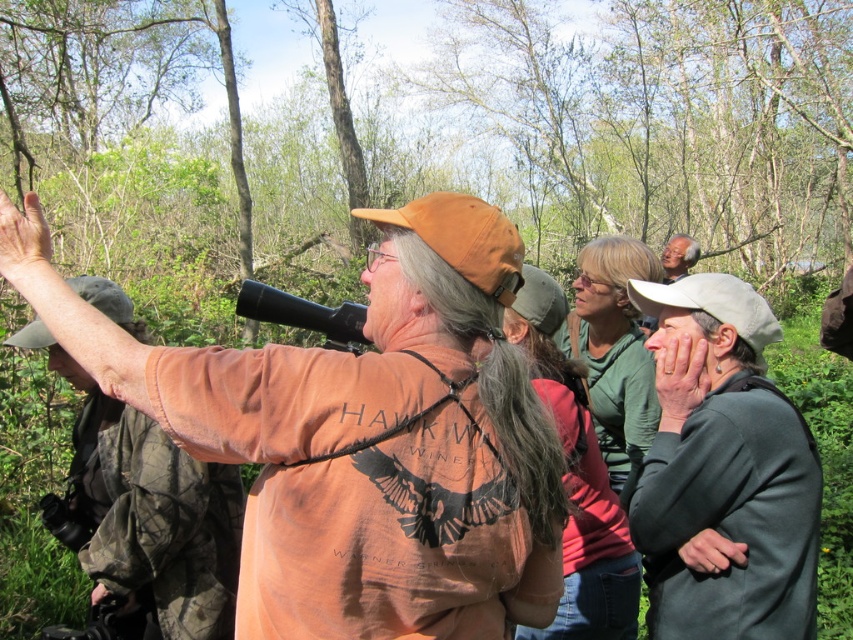
You are a hiker who wants to take a photo of the orange fabric shirt at center and the gray fabric jacket at right. Which one is closer to you?

The orange fabric shirt at center is closer to you because it is in front of the gray fabric jacket at right.

You are a photographer trying to capture a photo of the orange fabric shirt at upper left and the smooth brown hat at upper right. Which object should you focus on first if you want to ensure both are in the frame?

The orange fabric shirt at upper left is positioned under the smooth brown hat at upper right, so you should focus on the smooth brown hat at upper right first to ensure both are in the frame.